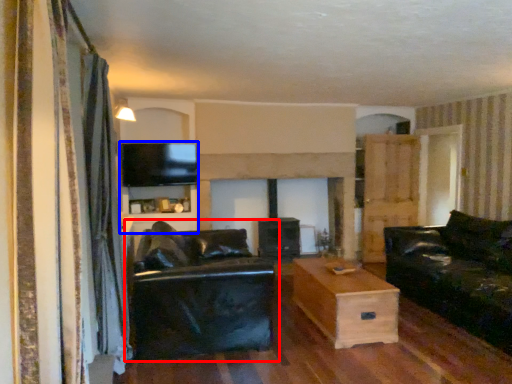
Question: Which point is closer to the camera, studio couch (highlighted by a red box) or entertainment center (highlighted by a blue box)?

Choices:
 (A) studio couch
 (B) entertainment center

Answer: (A)